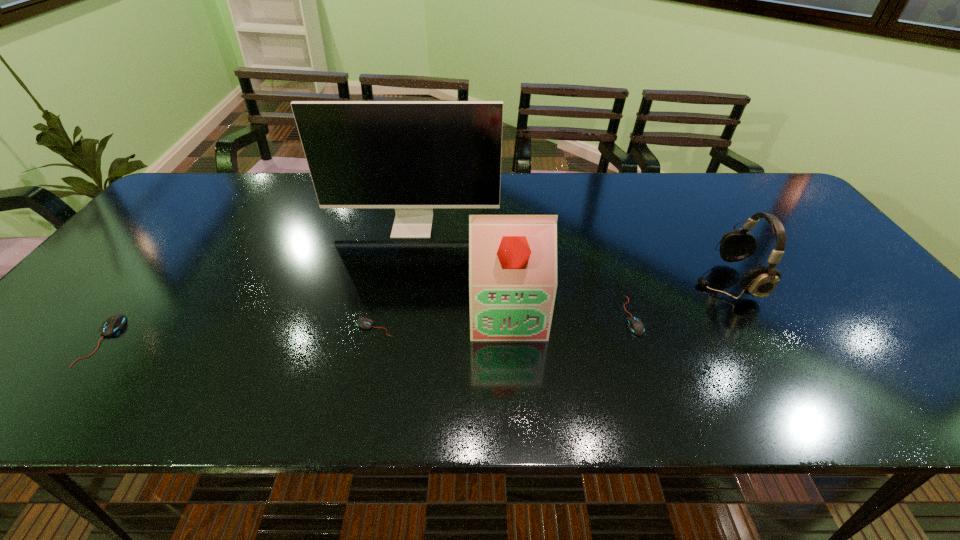
Find the location of a particular element. The height and width of the screenshot is (540, 960). the leftmost mouse is located at coordinates (112, 324).

In order to click on the tallest mouse in this screenshot , I will do `click(112, 324)`.

Find the location of a particular element. the shortest object is located at coordinates (364, 323).

Locate an element on the screen. The image size is (960, 540). the shortest mouse is located at coordinates (364, 323).

What are the coordinates of `the second tallest mouse` in the screenshot? It's located at (635, 325).

The width and height of the screenshot is (960, 540). I want to click on the rightmost mouse, so click(635, 325).

Locate an element on the screen. The image size is (960, 540). the farthest object is located at coordinates (413, 156).

At what (x,y) coordinates should I click in order to perform the action: click on monitor. Please return your answer as a coordinate pair (x, y). The width and height of the screenshot is (960, 540). Looking at the image, I should click on (413, 156).

Locate an element on the screen. Image resolution: width=960 pixels, height=540 pixels. the fifth shortest object is located at coordinates (512, 257).

Where is `headset`? headset is located at coordinates (760, 281).